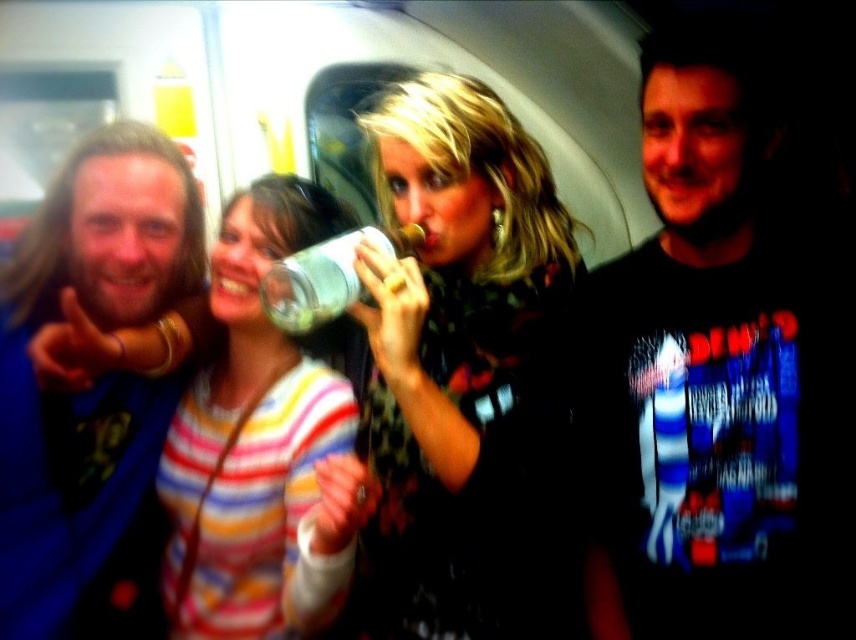
Does floral-patterned shirt at center appear under striped sweater at center?

No.

Which is below, floral-patterned shirt at center or striped sweater at center?

Positioned lower is striped sweater at center.

This screenshot has height=640, width=856. Find the location of `floral-patterned shirt at center`. floral-patterned shirt at center is located at coordinates (464, 378).

Which of these two, black printed t-shirt at right or striped sweater at center, stands taller?

With more height is black printed t-shirt at right.

What are the coordinates of `black printed t-shirt at right` in the screenshot? It's located at (726, 360).

Is black printed t-shirt at right thinner than transparent plastic bottle at center?

→ Incorrect, black printed t-shirt at right's width is not less than transparent plastic bottle at center's.

Who is more forward, [782,541] or [278,269]?

Point [782,541] is more forward.

Where is `black printed t-shirt at right`? black printed t-shirt at right is located at coordinates click(726, 360).